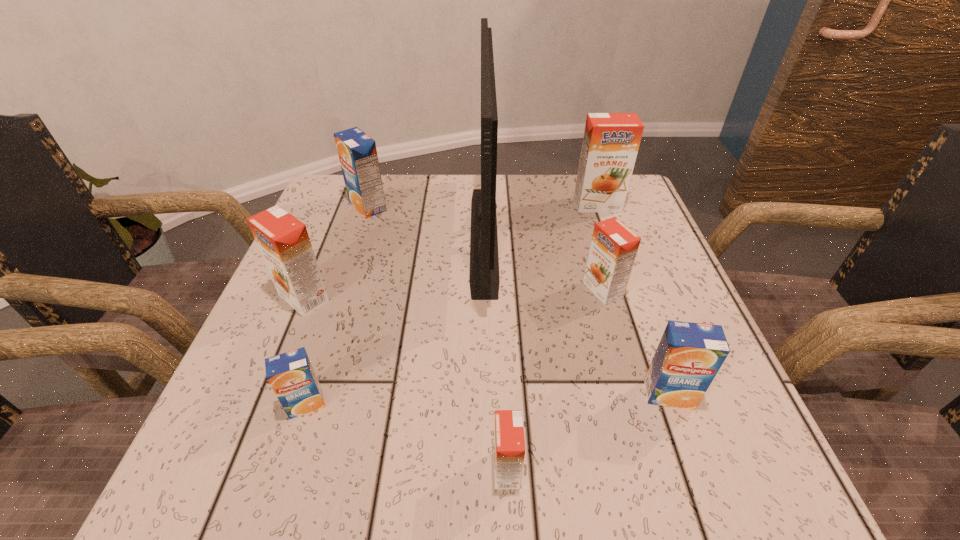
The width and height of the screenshot is (960, 540). I want to click on vacant region located 0.330m on the front-facing side of the tallest object, so click(324, 237).

Find the location of a particular element. This screenshot has height=540, width=960. free space located 0.160m on the front-facing side of the tallest object is located at coordinates (399, 237).

The height and width of the screenshot is (540, 960). Identify the location of free spot located on the front-facing side of the tallest object. (448, 237).

The width and height of the screenshot is (960, 540). I want to click on free location located on the right of the biggest orange orange juice, so click(640, 205).

At what (x,y) coordinates should I click in order to perform the action: click on vacant space located on the right of the biggest blue orange_juice. Please return your answer as a coordinate pair (x, y). The height and width of the screenshot is (540, 960). Looking at the image, I should click on (474, 206).

Find the location of `blank space located on the right of the second biggest orange orange juice`. blank space located on the right of the second biggest orange orange juice is located at coordinates (476, 298).

Image resolution: width=960 pixels, height=540 pixels. Find the location of `vacant space located on the back of the third biggest orange orange juice`. vacant space located on the back of the third biggest orange orange juice is located at coordinates (570, 176).

Locate an element on the screen. The width and height of the screenshot is (960, 540). vacant space located on the left of the rightmost blue orange_juice is located at coordinates pyautogui.click(x=530, y=394).

Locate an element on the screen. This screenshot has width=960, height=540. free point located on the left of the smallest blue orange_juice is located at coordinates (240, 404).

The image size is (960, 540). I want to click on free space located on the left of the nearest orange orange juice, so (x=342, y=469).